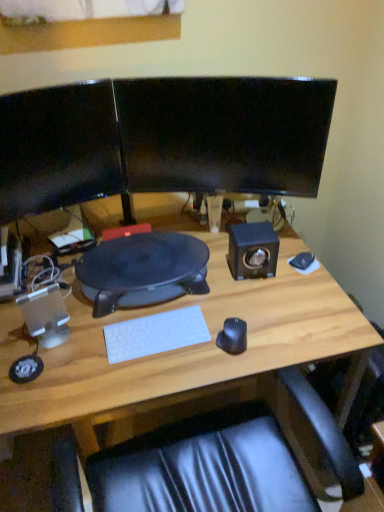
This screenshot has height=512, width=384. Identify the location of free spot in front of matte black speaker at right, the 1th speaker viewed from the back. (259, 303).